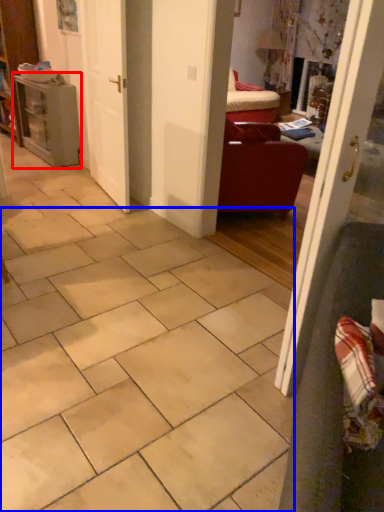
Question: Which object is closer to the camera taking this photo, table (highlighted by a red box) or ceramic tile (highlighted by a blue box)?

Choices:
 (A) table
 (B) ceramic tile

Answer: (B)